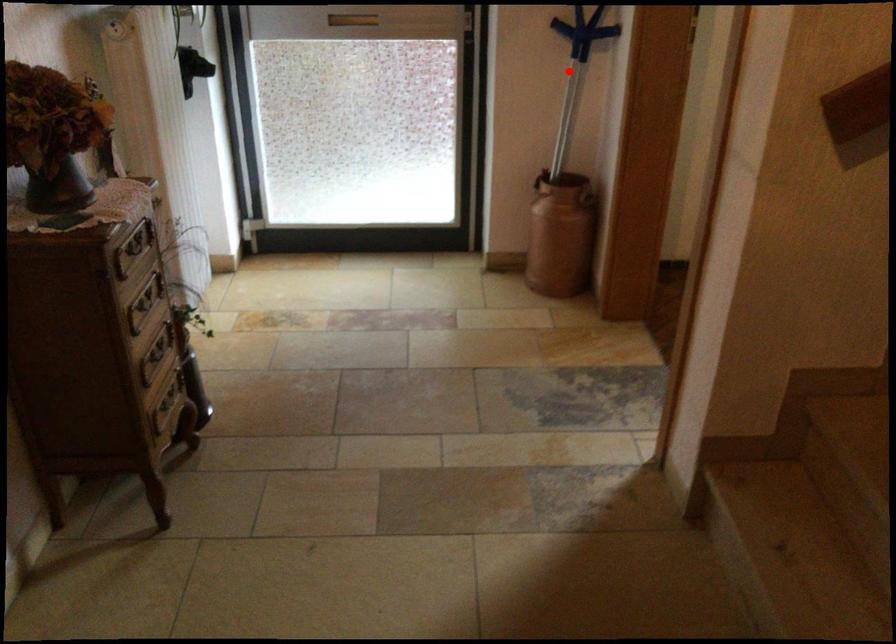
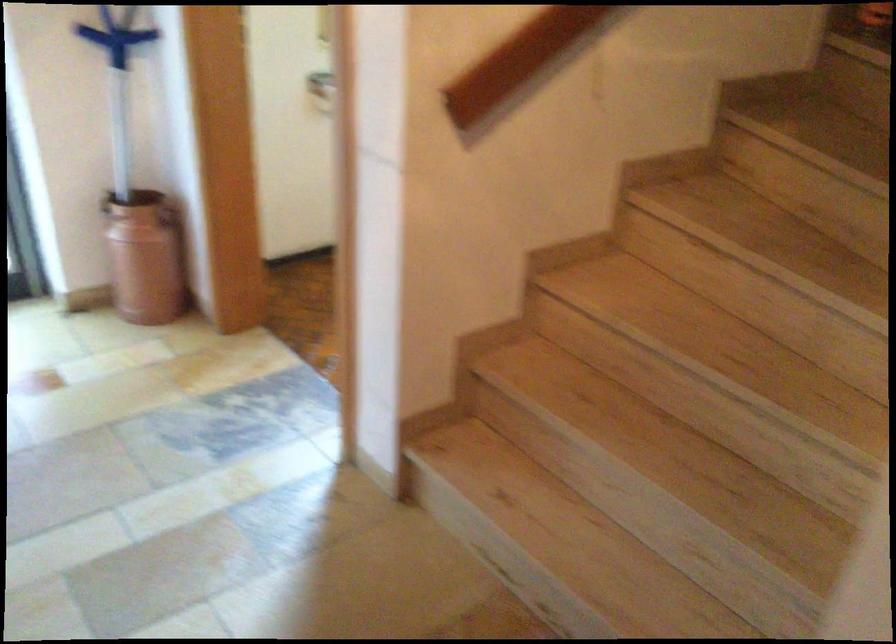
Question: I am providing you with two images of the same scene from different viewpoints. A red point is marked on the first image. Is the red point's position out of view in image 2?

Choices:
 (A) Yes
 (B) No

Answer: (B)